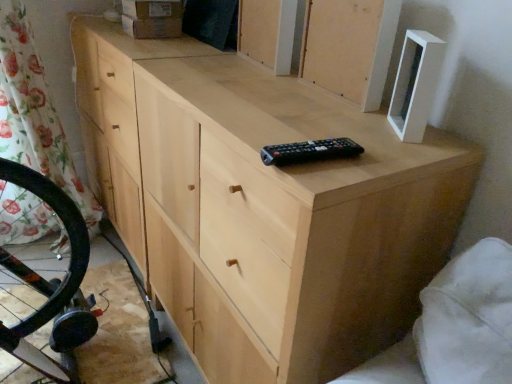
What are the coordinates of `free space to the back side of black plastic remote control at center` in the screenshot? It's located at (302, 118).